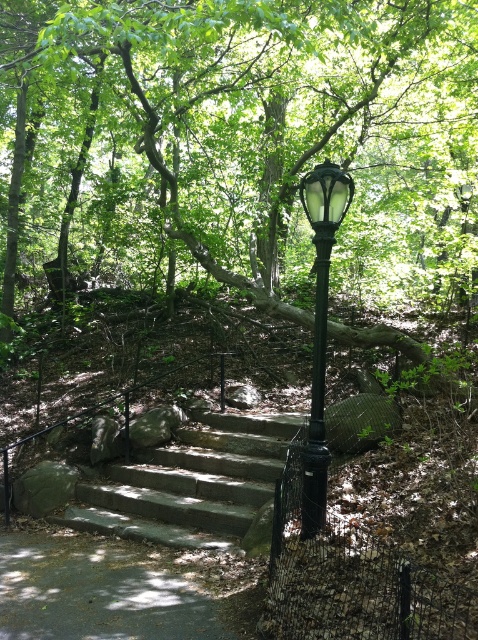
Question: Which of the following is the farthest from the observer?

Choices:
 (A) (66, 516)
 (B) (308, 481)
 (C) (341, 170)

Answer: (A)

Question: Is black glass lamp post at center below black metal pole at center?

Choices:
 (A) yes
 (B) no

Answer: (B)

Question: Does gray stone stairs at center appear under black glass lamp post at center?

Choices:
 (A) no
 (B) yes

Answer: (B)

Question: Which point is closer to the camera taking this photo?

Choices:
 (A) (231, 448)
 (B) (319, 365)

Answer: (B)

Question: Is gray stone stairs at center thinner than black metal pole at center?

Choices:
 (A) yes
 (B) no

Answer: (B)

Question: Which object is the farthest from the gray stone stairs at center?

Choices:
 (A) black metal pole at center
 (B) black glass lamp post at center

Answer: (B)